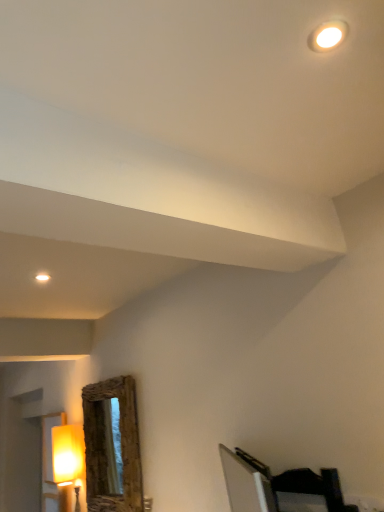
Question: Is dark wood bed at lower right surrounding matte yellow lampshade at left?

Choices:
 (A) no
 (B) yes

Answer: (A)

Question: Considering the relative sizes of dark wood bed at lower right and matte yellow lampshade at left in the image provided, is dark wood bed at lower right taller than matte yellow lampshade at left?

Choices:
 (A) no
 (B) yes

Answer: (A)

Question: Is dark wood bed at lower right positioned in front of matte yellow lampshade at left?

Choices:
 (A) no
 (B) yes

Answer: (B)

Question: Is dark wood bed at lower right at the right side of matte yellow lampshade at left?

Choices:
 (A) yes
 (B) no

Answer: (A)

Question: Is dark wood bed at lower right beside matte yellow lampshade at left?

Choices:
 (A) no
 (B) yes

Answer: (A)

Question: In the image, is matte yellow lampshade at left positioned in front of or behind dark wood bed at lower right?

Choices:
 (A) front
 (B) behind

Answer: (B)

Question: Considering the positions of matte yellow lampshade at left and dark wood bed at lower right in the image, is matte yellow lampshade at left taller or shorter than dark wood bed at lower right?

Choices:
 (A) tall
 (B) short

Answer: (A)

Question: From the image's perspective, relative to dark wood bed at lower right, is matte yellow lampshade at left above or below?

Choices:
 (A) above
 (B) below

Answer: (B)

Question: Considering the positions of point (61, 437) and point (261, 481), is point (61, 437) closer or farther from the camera than point (261, 481)?

Choices:
 (A) farther
 (B) closer

Answer: (A)

Question: From the image's perspective, is matte yellow lampshade at left located above or below rustic wood mirror at lower left?

Choices:
 (A) above
 (B) below

Answer: (B)

Question: Is matte yellow lampshade at left spatially inside rustic wood mirror at lower left, or outside of it?

Choices:
 (A) inside
 (B) outside

Answer: (B)

Question: Based on their sizes in the image, would you say matte yellow lampshade at left is bigger or smaller than rustic wood mirror at lower left?

Choices:
 (A) small
 (B) big

Answer: (A)

Question: Is point (61, 446) positioned closer to the camera than point (127, 487)?

Choices:
 (A) farther
 (B) closer

Answer: (A)

Question: Does point [84, 428] appear closer or farther from the camera than point [314, 478]?

Choices:
 (A) farther
 (B) closer

Answer: (A)

Question: From a real-world perspective, relative to dark wood bed at lower right, is rustic wood mirror at lower left vertically above or below?

Choices:
 (A) below
 (B) above

Answer: (B)